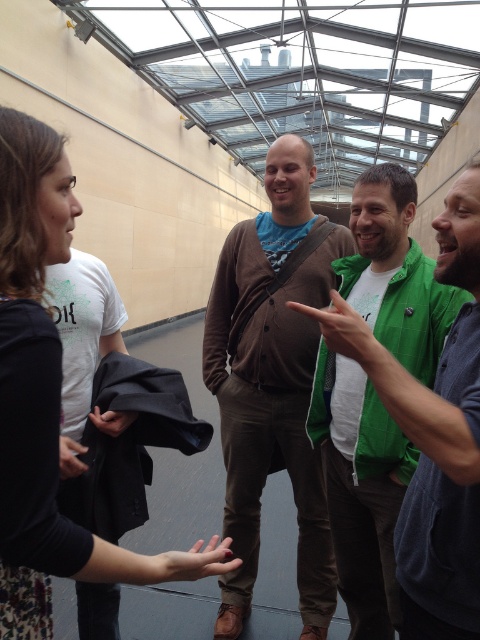
Is smooth skin hand at center positioned at the back of black fabric at lower left?

That is False.

Is smooth skin hand at center below black fabric at lower left?

Correct, smooth skin hand at center is located below black fabric at lower left.

Measure the distance between smooth skin hand at center and camera.

smooth skin hand at center is 38.60 inches from camera.

This screenshot has height=640, width=480. What are the coordinates of `smooth skin hand at center` in the screenshot? It's located at (194, 561).

Is point (370, 435) positioned behind point (67, 460)?

Yes, it is.

Looking at this image, who is lower down, green fabric jacket at center or black fabric at lower left?

black fabric at lower left is below.

The width and height of the screenshot is (480, 640). Find the location of `green fabric jacket at center`. green fabric jacket at center is located at coordinates (373, 388).

Does black fabric at lower left have a greater height compared to black fabric at center?

Yes.

Which is in front, point (81, 472) or point (121, 419)?

Positioned in front is point (81, 472).

Where is `black fabric at lower left`? This screenshot has height=640, width=480. black fabric at lower left is located at coordinates (x=70, y=458).